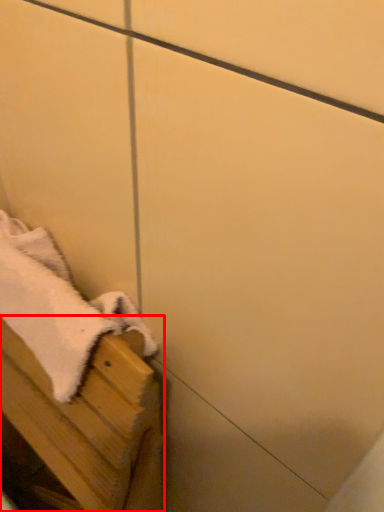
Question: From the image's perspective, what is the correct spatial relationship of furniture (annotated by the red box) in relation to bath towel?

Choices:
 (A) above
 (B) below

Answer: (B)